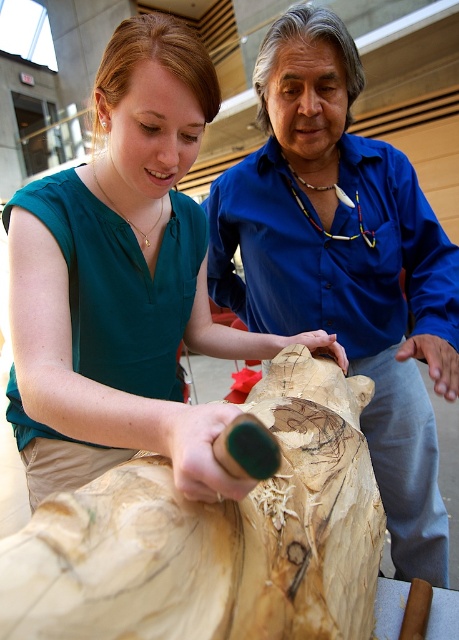
Question: Which point appears farthest from the camera in this image?

Choices:
 (A) (38, 301)
 (B) (407, 468)

Answer: (B)

Question: Is teal fabric shirt at center further to the viewer compared to blue smooth shirt at center?

Choices:
 (A) yes
 (B) no

Answer: (B)

Question: Observing the image, what is the correct spatial positioning of teal fabric shirt at center in reference to blue smooth shirt at center?

Choices:
 (A) right
 (B) left

Answer: (B)

Question: Can you confirm if teal fabric shirt at center is positioned to the left of blue smooth shirt at center?

Choices:
 (A) no
 (B) yes

Answer: (B)

Question: Which point is closer to the camera?

Choices:
 (A) (194, 410)
 (B) (419, 259)

Answer: (A)